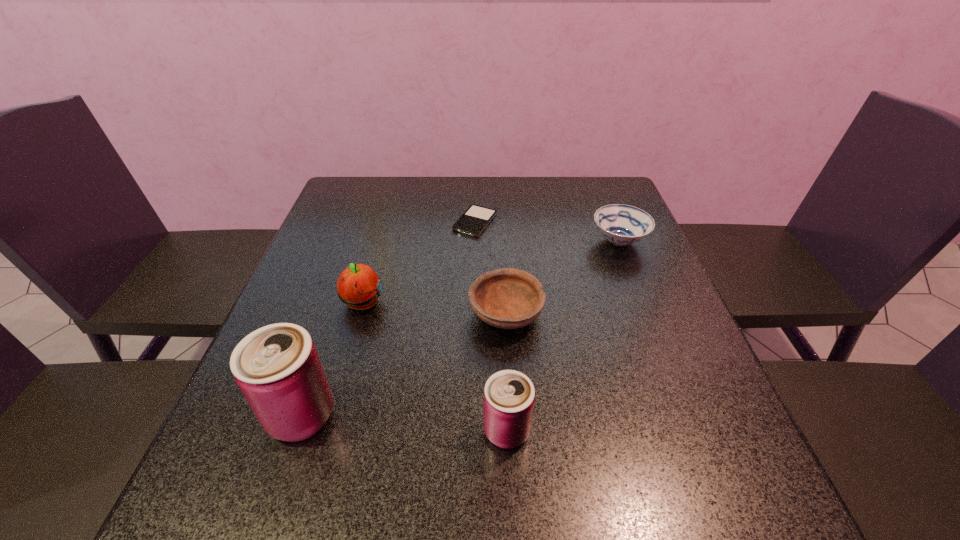
I want to click on vacant area that lies between the right can and the soup bowl, so click(x=563, y=336).

Where is `free point between the iPod and the right can`? free point between the iPod and the right can is located at coordinates (491, 326).

Choose which object is the fifth nearest neighbor to the shorter can. Please provide its 2D coordinates. Your answer should be formatted as a tuple, i.e. [(x, y)], where the tuple contains the x and y coordinates of a point satisfying the conditions above.

[(475, 219)]

The width and height of the screenshot is (960, 540). I want to click on the fifth closest object to the iPod, so click(x=509, y=395).

At what (x,y) coordinates should I click in order to perform the action: click on vacant space that satisfies the following two spatial constraints: 1. on the front side of the apple; 2. on the right side of the right can. Please return your answer as a coordinate pair (x, y). Image resolution: width=960 pixels, height=540 pixels. Looking at the image, I should click on (325, 430).

Where is `free location that satisfies the following two spatial constraints: 1. on the back side of the bowl; 2. on the right side of the shorter can`? free location that satisfies the following two spatial constraints: 1. on the back side of the bowl; 2. on the right side of the shorter can is located at coordinates (501, 314).